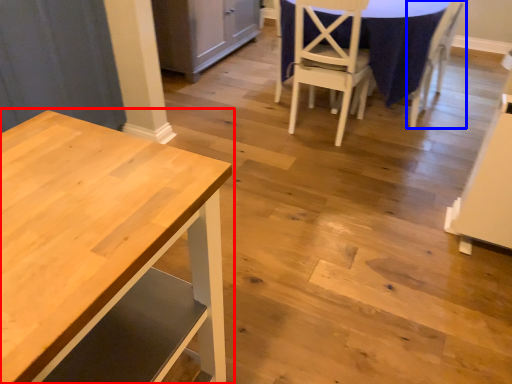
Question: Which of the following is the closest to the observer, table (highlighted by a red box) or chair (highlighted by a blue box)?

Choices:
 (A) table
 (B) chair

Answer: (A)